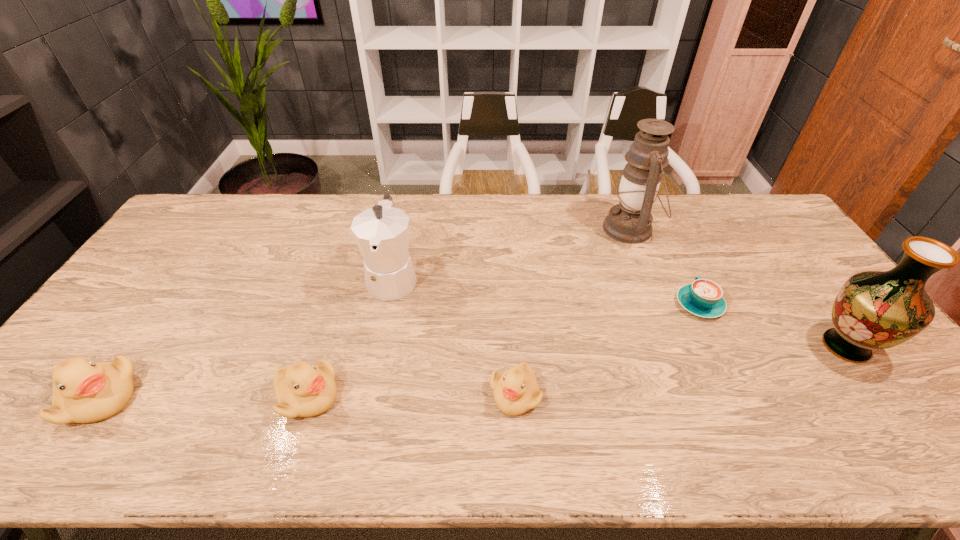
Given the evenly spaced ducklings in the image, where should an extra duckling be added on the right to preserve the spacing? Please point to a vacant space. Please provide its 2D coordinates. Your answer should be formatted as a tuple, i.e. [(x, y)], where the tuple contains the x and y coordinates of a point satisfying the conditions above.

[(721, 392)]